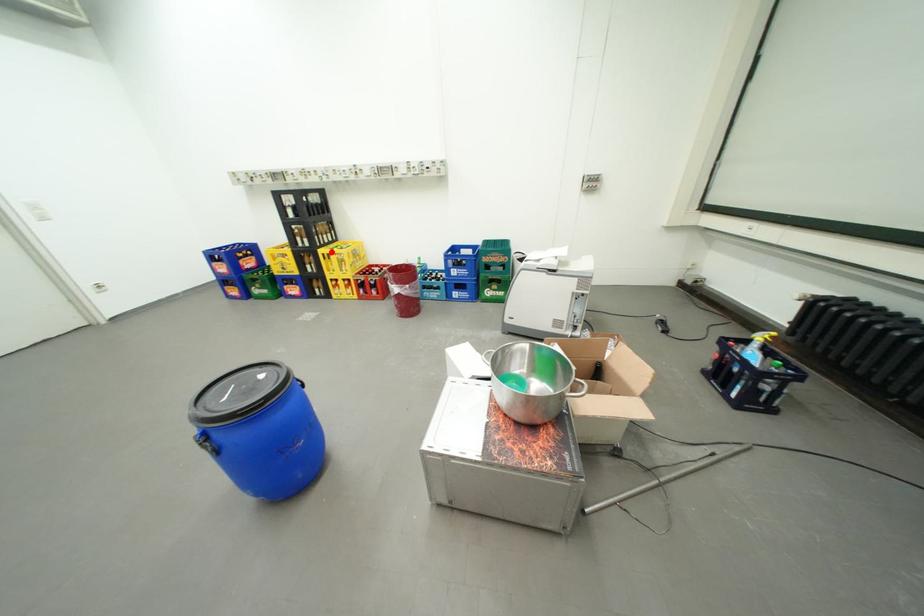
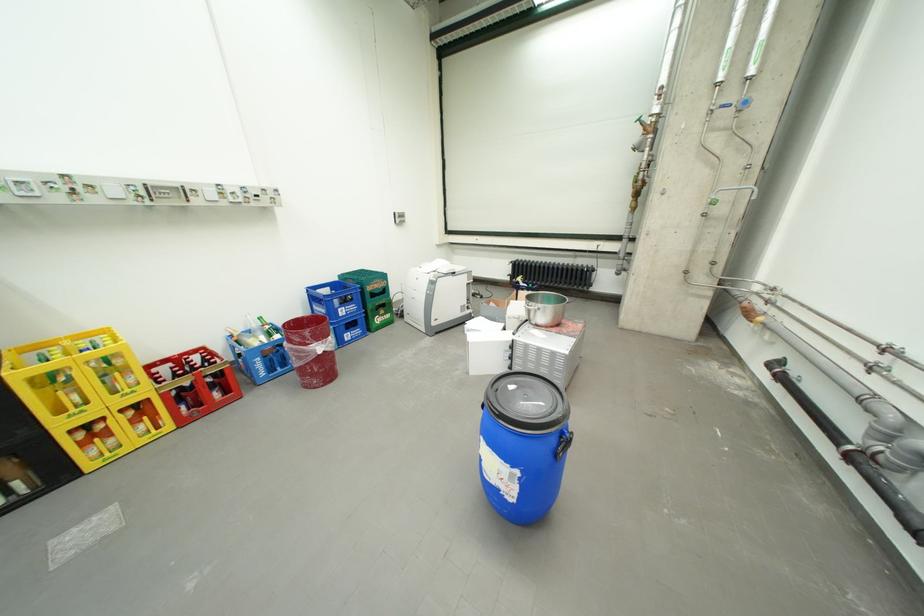
Find the pixel in the second image that matches the highlighted location in the first image.

(30, 374)